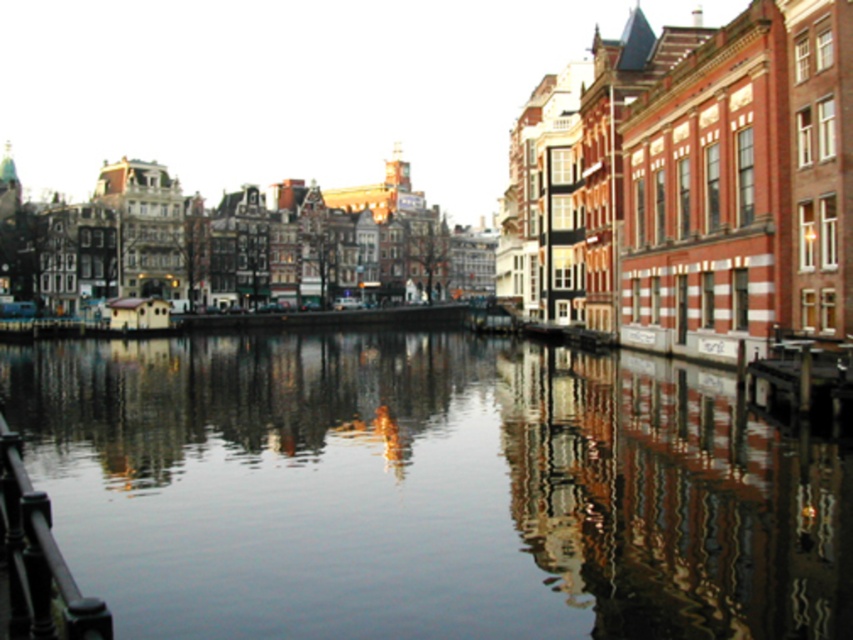
Question: Does smooth reflective water at center have a larger size compared to black metal railing at lower left?

Choices:
 (A) yes
 (B) no

Answer: (A)

Question: Is smooth reflective water at center above black metal railing at lower left?

Choices:
 (A) no
 (B) yes

Answer: (B)

Question: Which object appears closest to the camera in this image?

Choices:
 (A) black metal railing at lower left
 (B) smooth reflective water at center

Answer: (A)

Question: Can you confirm if smooth reflective water at center is bigger than black metal railing at lower left?

Choices:
 (A) yes
 (B) no

Answer: (A)

Question: Which of the following is the closest to the observer?

Choices:
 (A) (51, 586)
 (B) (119, 625)

Answer: (A)